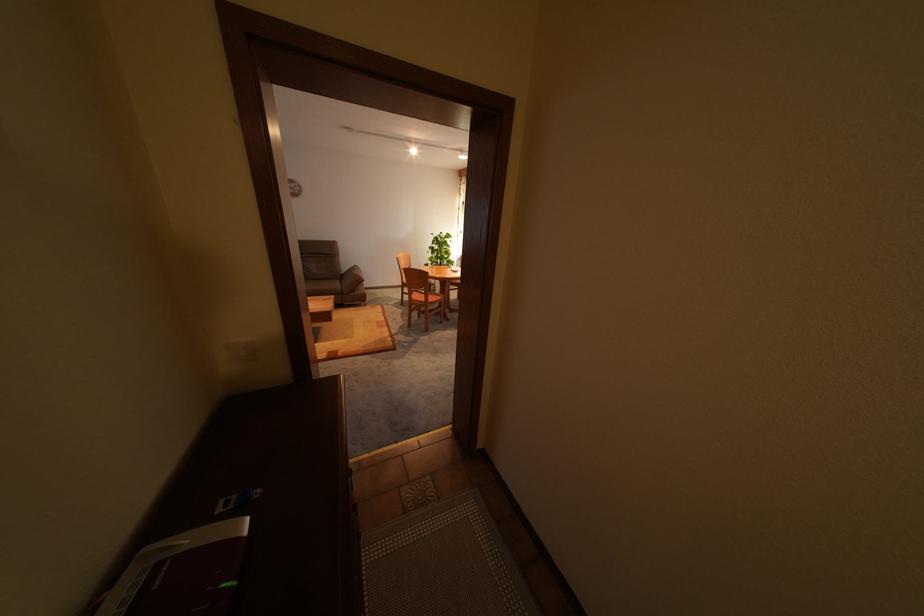
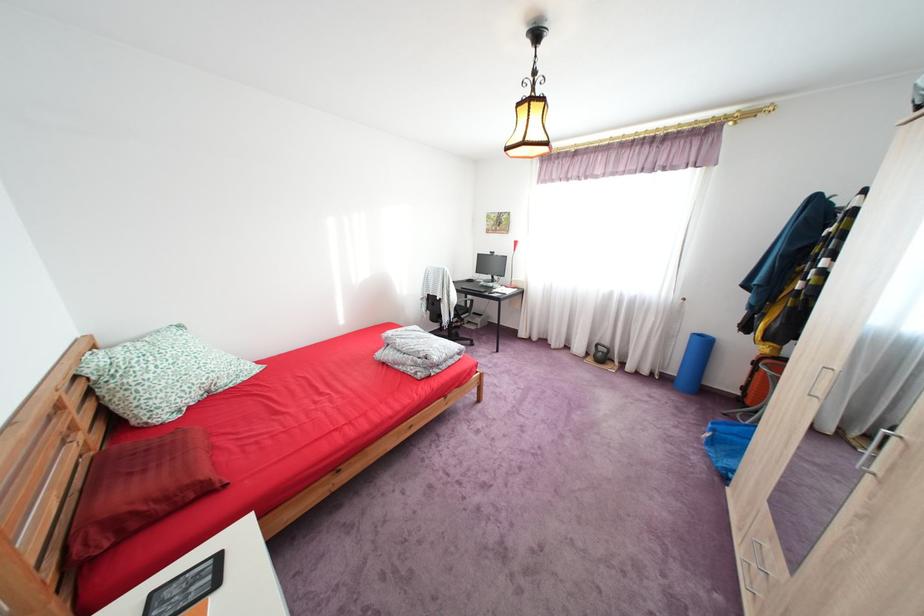
In a continuous first-person perspective shot, in which direction is the camera moving?

The movement direction of the cameraman is right, backward.